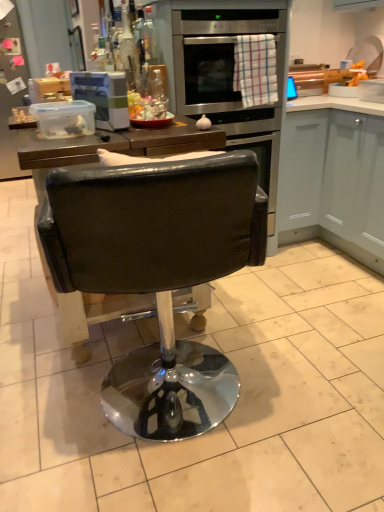
The height and width of the screenshot is (512, 384). What do you see at coordinates (334, 176) in the screenshot?
I see `white matte cabinet at right` at bounding box center [334, 176].

Measure the distance between point (339, 220) and camera.

Point (339, 220) and camera are 8.58 feet apart.

In order to click on white matte cabinet at right in this screenshot , I will do `click(334, 176)`.

In order to click on black leather chair at center in this screenshot , I will do `click(158, 273)`.

What do you see at coordinates (158, 273) in the screenshot? I see `black leather chair at center` at bounding box center [158, 273].

At what (x,y) coordinates should I click in order to perform the action: click on white matte cabinet at right. Please return your answer as a coordinate pair (x, y). This screenshot has width=384, height=512. Looking at the image, I should click on (334, 176).

Looking at this image, between white matte cabinet at right and black leather chair at center, which one appears on the left side from the viewer's perspective?

From the viewer's perspective, black leather chair at center appears more on the left side.

Considering their positions, is white matte cabinet at right located in front of or behind black leather chair at center?

Visually, white matte cabinet at right is located behind black leather chair at center.

In the scene shown: Which is less distant, (312, 149) or (216, 172)?

Positioned in front is point (216, 172).

In the scene shown: From the image's perspective, which one is positioned lower, white matte cabinet at right or black leather chair at center?

From the image's view, black leather chair at center is below.

From a real-world perspective, which is physically below, white matte cabinet at right or black leather chair at center?

In real-world perspective, white matte cabinet at right is lower.

Which of these two, white matte cabinet at right or black leather chair at center, is wider?

black leather chair at center is wider.

From the picture: Which of these two, white matte cabinet at right or black leather chair at center, stands shorter?

white matte cabinet at right is shorter.

Does white matte cabinet at right have a smaller size compared to black leather chair at center?

Incorrect, white matte cabinet at right is not smaller in size than black leather chair at center.

Can black leather chair at center be found inside white matte cabinet at right?

No.

Is white matte cabinet at right positioned far away from black leather chair at center?

Indeed, white matte cabinet at right is not near black leather chair at center.

Is white matte cabinet at right looking in the opposite direction of black leather chair at center?

No, black leather chair at center is not at the back of white matte cabinet at right.

The height and width of the screenshot is (512, 384). Find the location of `chair that appears in front of the white matte cabinet at right`. chair that appears in front of the white matte cabinet at right is located at coordinates (158, 273).

Between black leather chair at center and white matte cabinet at right, which one appears on the left side from the viewer's perspective?

black leather chair at center is more to the left.

From the picture: Does black leather chair at center lie in front of white matte cabinet at right?

That is True.

Is point (194, 223) farther from camera compared to point (335, 156)?

That is False.

From the image's perspective, is black leather chair at center positioned above or below white matte cabinet at right?

black leather chair at center is below white matte cabinet at right.

From a real-world perspective, who is located higher, black leather chair at center or white matte cabinet at right?

black leather chair at center, from a real-world perspective.

Looking at this image, is black leather chair at center thinner than white matte cabinet at right?

In fact, black leather chair at center might be wider than white matte cabinet at right.

Considering the relative sizes of black leather chair at center and white matte cabinet at right in the image provided, is black leather chair at center taller than white matte cabinet at right?

Indeed, black leather chair at center has a greater height compared to white matte cabinet at right.

Can you confirm if black leather chair at center is bigger than white matte cabinet at right?

No.

Which is correct: black leather chair at center is inside white matte cabinet at right, or outside of it?

black leather chair at center is outside white matte cabinet at right.

Is black leather chair at center far from white matte cabinet at right?

Yes.

Is black leather chair at center facing away from white matte cabinet at right?

black leather chair at center does not have its back to white matte cabinet at right.

How far apart are black leather chair at center and white matte cabinet at right?

black leather chair at center is 1.51 meters from white matte cabinet at right.

The image size is (384, 512). I want to click on chair on the left of white matte cabinet at right, so pos(158,273).

Where is `chair below the white matte cabinet at right (from the image's perspective)`? The height and width of the screenshot is (512, 384). chair below the white matte cabinet at right (from the image's perspective) is located at coordinates (158, 273).

You are a GUI agent. You are given a task and a screenshot of the screen. Output one action in this format:
    pyautogui.click(x=<x>, y=<y>)
    Task: Click on the cabinetry directly beneath the black leather chair at center (from a real-world perspective)
    The height and width of the screenshot is (512, 384).
    Given the screenshot: What is the action you would take?
    pyautogui.click(x=334, y=176)